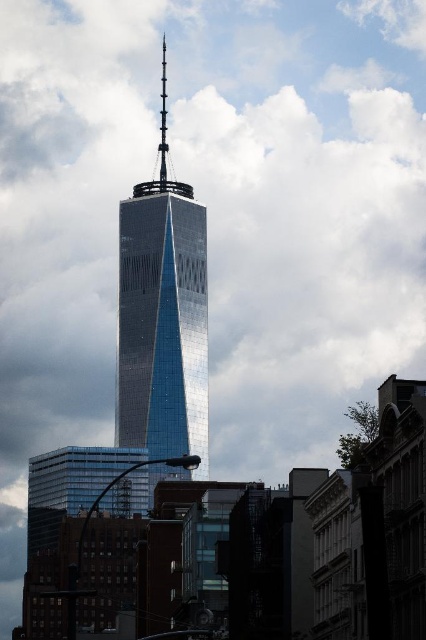
Question: Is shiny glass skyscraper at center bigger than polished steel spire at center?

Choices:
 (A) yes
 (B) no

Answer: (A)

Question: Can you confirm if shiny glass skyscraper at center is smaller than polished steel spire at center?

Choices:
 (A) yes
 (B) no

Answer: (B)

Question: Which point is closer to the camera taking this photo?

Choices:
 (A) (184, 205)
 (B) (160, 166)

Answer: (A)

Question: Which point is closer to the camera taking this photo?

Choices:
 (A) (155, 252)
 (B) (181, 189)

Answer: (A)

Question: Which of the following is the closest to the observer?

Choices:
 (A) (198, 324)
 (B) (132, 189)

Answer: (A)

Question: From the image, what is the correct spatial relationship of shiny glass skyscraper at center in relation to polished steel spire at center?

Choices:
 (A) right
 (B) left

Answer: (A)